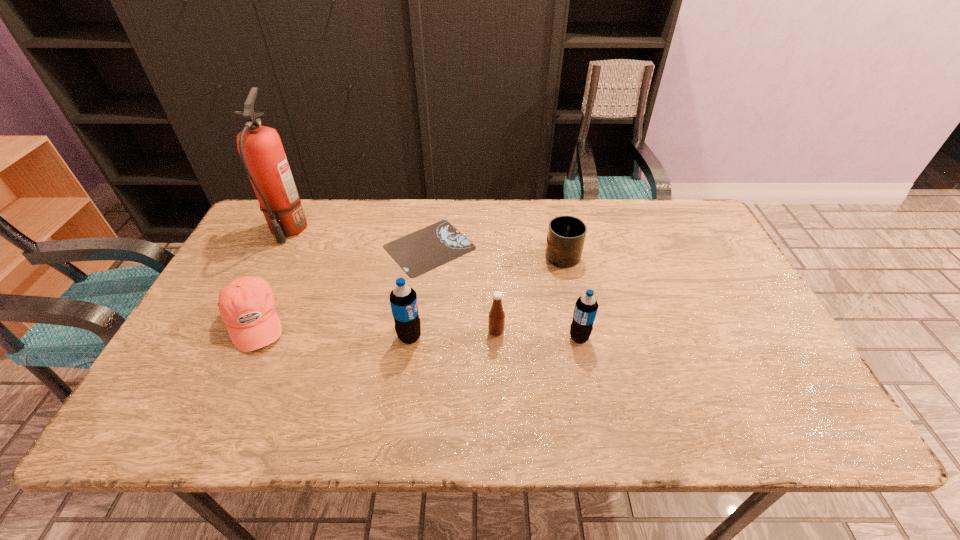
Locate an element on the screen. This screenshot has width=960, height=540. free point between the shortest object and the taller soda bottle is located at coordinates (420, 292).

Identify the location of free spot between the shortest object and the fifth object from left to right. (463, 289).

This screenshot has height=540, width=960. Find the location of `vacant space that is in between the left soda bottle and the shortest object`. vacant space that is in between the left soda bottle and the shortest object is located at coordinates (420, 292).

Where is `free spot between the fifth shortest object and the mousepad`? free spot between the fifth shortest object and the mousepad is located at coordinates 504,292.

Identify the location of vacant region between the left soda bottle and the shorter soda bottle. (494, 337).

Identify the location of vacant space that is in between the tallest object and the sixth shortest object. The height and width of the screenshot is (540, 960). (348, 284).

This screenshot has height=540, width=960. What are the coordinates of `vacant space that's between the baseball cap and the sixth shortest object` in the screenshot? It's located at (331, 329).

Where is `vacant region between the baseball cap and the Tabasco sauce`? Image resolution: width=960 pixels, height=540 pixels. vacant region between the baseball cap and the Tabasco sauce is located at coordinates (374, 327).

Where is `vacant area that lies between the fifth shortest object and the shortest object`? vacant area that lies between the fifth shortest object and the shortest object is located at coordinates (504, 292).

You are a GUI agent. You are given a task and a screenshot of the screen. Output one action in this format:
    pyautogui.click(x=<x>, y=<y>)
    Task: Click on the object identified as the fifth closest to the mousepad
    
    Given the screenshot: What is the action you would take?
    pyautogui.click(x=260, y=147)